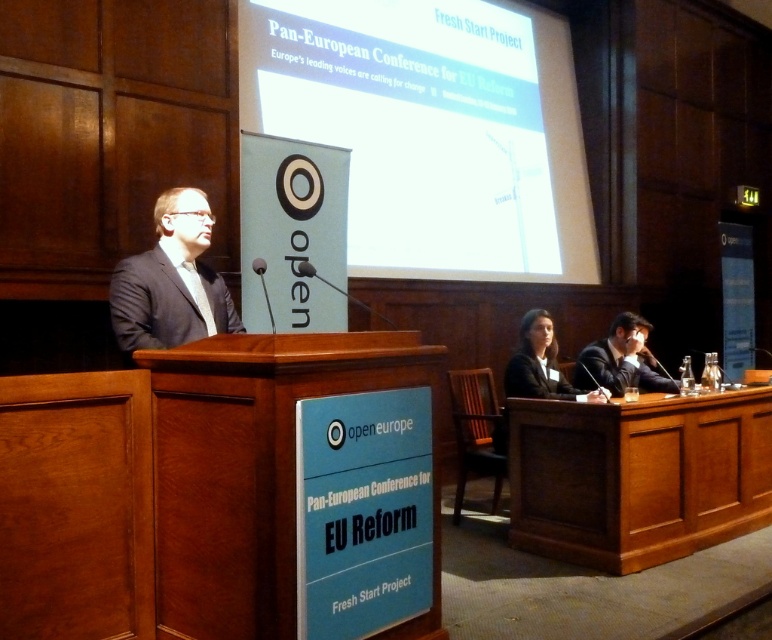
Can you confirm if wooden table at right is positioned to the left of black matte suit at lower right?

In fact, wooden table at right is to the right of black matte suit at lower right.

Is point (713, 444) less distant than point (659, 381)?

Yes, point (713, 444) is in front of point (659, 381).

You are a GUI agent. You are given a task and a screenshot of the screen. Output one action in this format:
    pyautogui.click(x=<x>, y=<y>)
    Task: Click on the wooden table at right
    This screenshot has height=640, width=772.
    Given the screenshot: What is the action you would take?
    pyautogui.click(x=637, y=476)

Is point (571, 88) positioned in front of point (513, 381)?

No, it is behind (513, 381).

Does white glossy projection screen at upper center have a smaller size compared to black matte suit at center?

No, white glossy projection screen at upper center is not smaller than black matte suit at center.

Between point (405, 72) and point (510, 365), which one is positioned in front?

Positioned in front is point (510, 365).

Find the location of a particular element. white glossy projection screen at upper center is located at coordinates (432, 129).

Is the position of wooden table at right more distant than that of black fabric suit at center?

No, it is in front of black fabric suit at center.

Is point (757, 397) less distant than point (530, 340)?

Yes, it is in front of point (530, 340).

Find the location of a particular element. wooden table at right is located at coordinates [637, 476].

This screenshot has width=772, height=640. Identify the location of wooden table at right. (637, 476).